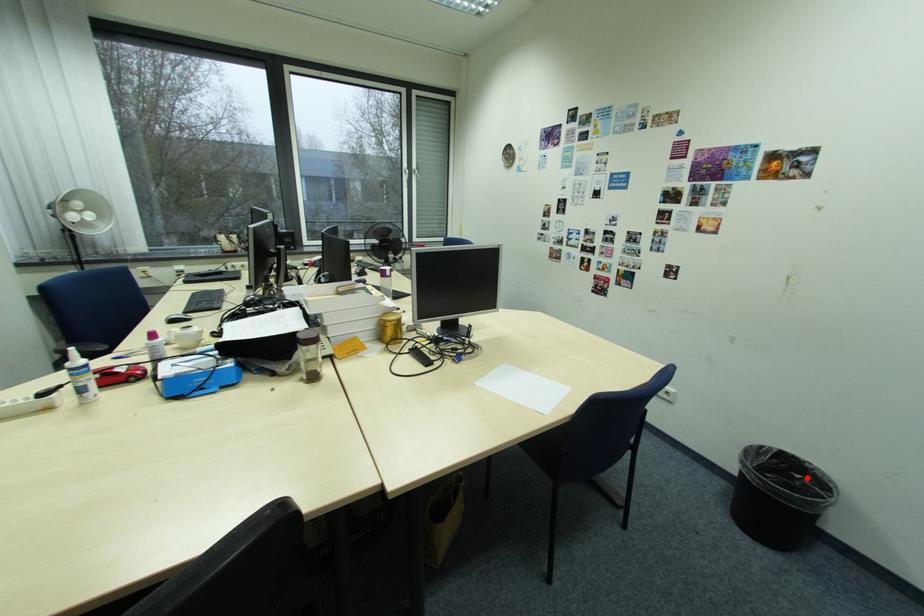
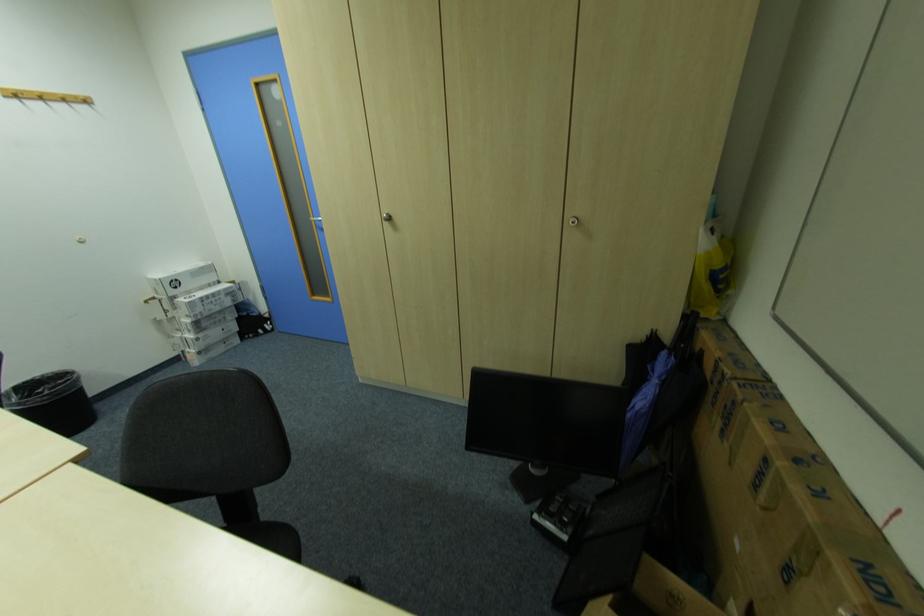
Question: I am providing you with two images of the same scene from different viewpoints. Given a red point in image1, look at the same physical point in image2. Is it:

Choices:
 (A) Closer to the viewpoint
 (B) Farther from the viewpoint

Answer: (B)